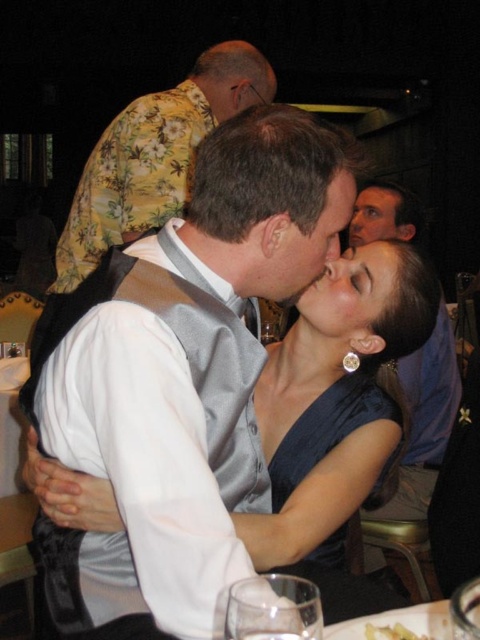
Image resolution: width=480 pixels, height=640 pixels. Describe the element at coordinates (425, 417) in the screenshot. I see `matte blue shirt at right` at that location.

You are a GUI agent. You are given a task and a screenshot of the screen. Output one action in this format:
    pyautogui.click(x=<x>, y=<y>)
    Task: Click on the matte blue shirt at right
    The height and width of the screenshot is (640, 480).
    Given the screenshot: What is the action you would take?
    pyautogui.click(x=425, y=417)

Does satin dark blue dress at center come in front of clear glass at center?

No, satin dark blue dress at center is behind clear glass at center.

Which is below, satin dark blue dress at center or clear glass at center?

clear glass at center is below.

Locate an element on the screen. satin dark blue dress at center is located at coordinates (336, 436).

Between point (380, 266) and point (427, 636), which one is positioned in front?

Point (427, 636) is more forward.

Is point (331, 282) less distant than point (383, 628)?

No, it is behind (383, 628).

Where is `satin blue dress at center`? The width and height of the screenshot is (480, 640). satin blue dress at center is located at coordinates (338, 417).